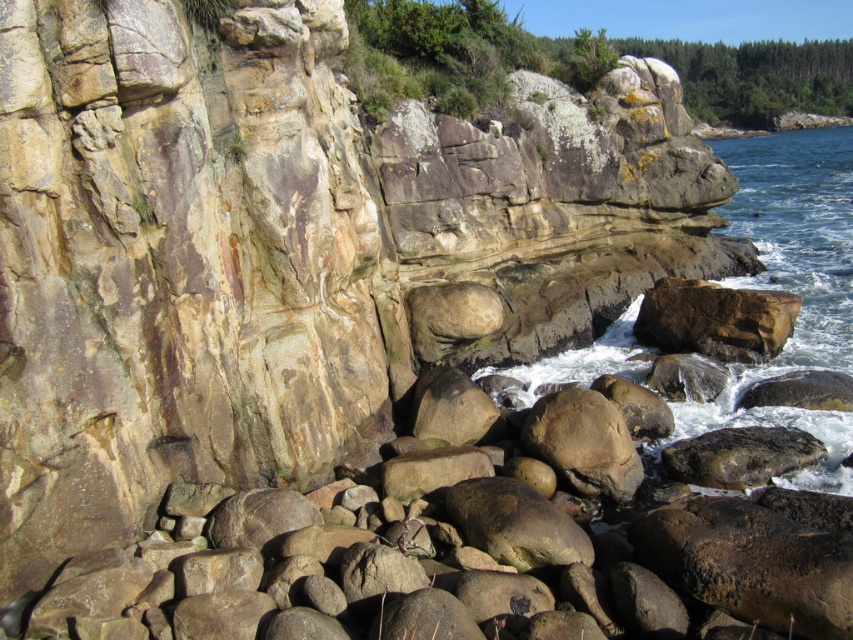
Can you confirm if clear blue water at right is wider than brown rough rock at center?

Yes, clear blue water at right is wider than brown rough rock at center.

Is point (817, 360) farther from camera compared to point (714, 312)?

Yes, it is.

You are a GUI agent. You are given a task and a screenshot of the screen. Output one action in this format:
    pyautogui.click(x=<x>, y=<y>)
    Task: Click on the clear blue water at right
    This screenshot has width=853, height=640.
    Given the screenshot: What is the action you would take?
    799,232